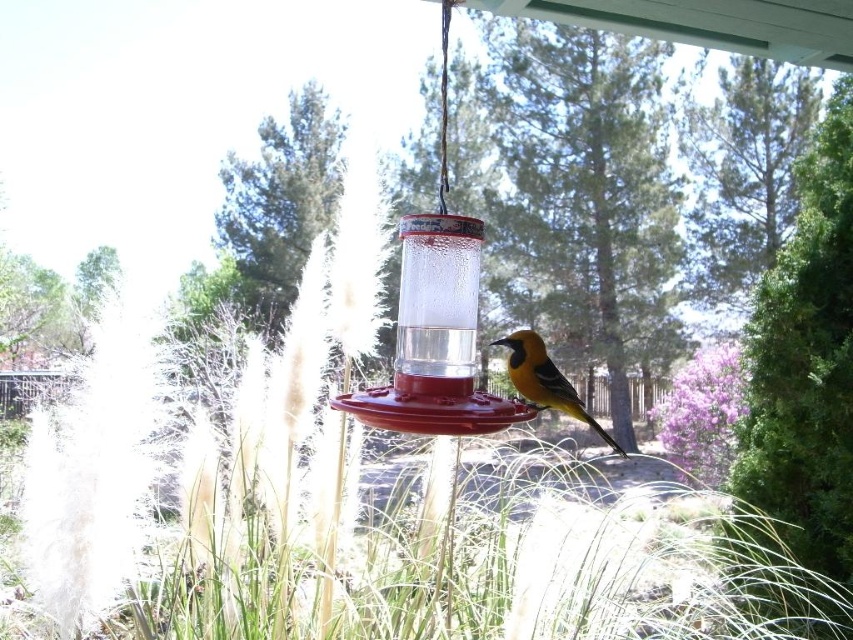
Question: Among these objects, which one is nearest to the camera?

Choices:
 (A) golden-yellow feathers at center
 (B) transparent plastic bird feeder at center

Answer: (B)

Question: Does transparent plastic bird feeder at center appear over golden-yellow feathers at center?

Choices:
 (A) no
 (B) yes

Answer: (B)

Question: Is transparent plastic bird feeder at center wider than golden-yellow feathers at center?

Choices:
 (A) no
 (B) yes

Answer: (B)

Question: Which point is farther from the camera taking this photo?

Choices:
 (A) (523, 339)
 (B) (511, 419)

Answer: (A)

Question: Can you confirm if transparent plastic bird feeder at center is positioned to the left of golden-yellow feathers at center?

Choices:
 (A) yes
 (B) no

Answer: (A)

Question: Among these points, which one is farthest from the camera?

Choices:
 (A) (387, 385)
 (B) (515, 349)

Answer: (B)